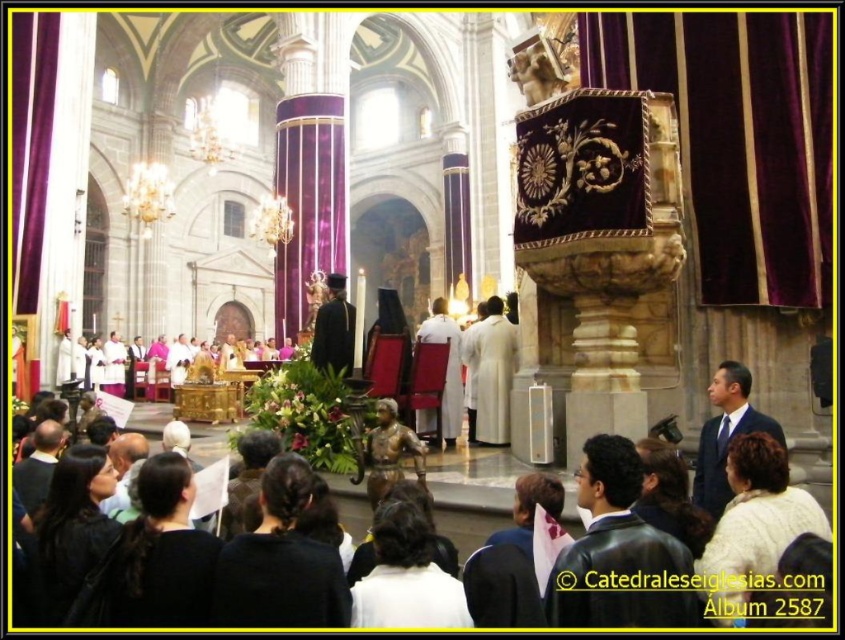
You are a photographer positioned at the back of the cathedral during the ceremony. You want to capture a clear photo of the white matte robe at center without the dark brown leather jacket at lower left blocking it. What should you do?

Since the dark brown leather jacket at lower left is behind the white matte robe at center, you can take the photo as is because the jacket won wait block the robe.

You are a guest attending the ceremony and want to see both the white matte robe at center and the black velvet robe at center clearly. Which robe should you move closer to in order to have a better view?

You should move closer to the black velvet robe at center because the white matte robe at center is closer to you already, while the black velvet robe at center is further away. Moving towards it would allow you to see both robes more clearly.

You are standing in the cathedral and want to take a photo of both the congregation and the altar. The congregation is at point (108, 563) and the altar is at point (748, 378). Which point should you focus on first to ensure both are in focus?

You should focus on point (108, 563) first because it is closer to the camera than point (748, 378). This way, the congregation will be in focus, and the altar will also be within the depth of field.